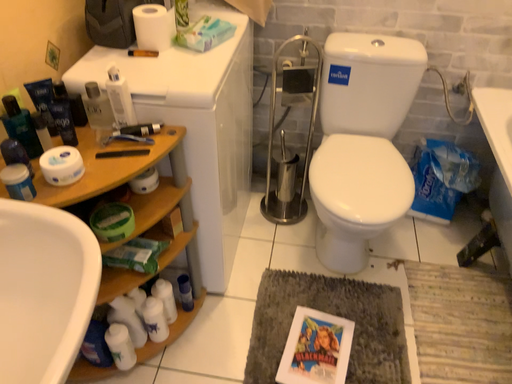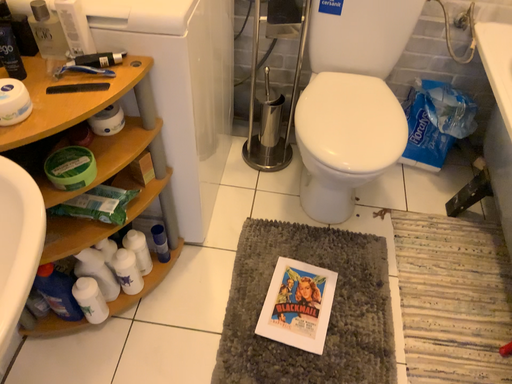
Question: Which way did the camera rotate in the video?

Choices:
 (A) rotated upward
 (B) rotated downward

Answer: (B)